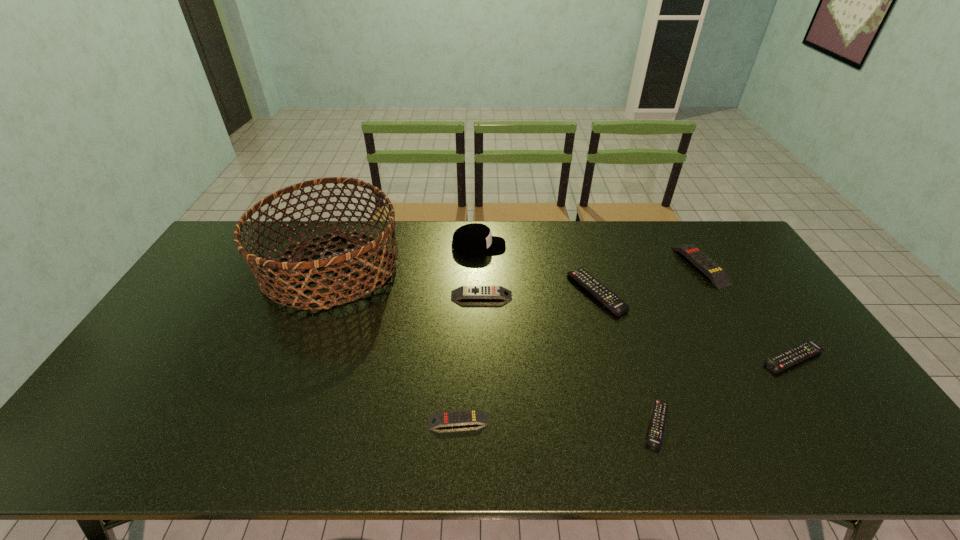
Locate an element on the screen. The image size is (960, 540). blank region between the tallest object and the farthest yellow remote control is located at coordinates (516, 266).

Identify which object is the second nearest to the rightmost black remote control. Please provide its 2D coordinates. Your answer should be formatted as a tuple, i.e. [(x, y)], where the tuple contains the x and y coordinates of a point satisfying the conditions above.

[(658, 418)]

The height and width of the screenshot is (540, 960). What are the coordinates of `object that stands as the fifth closest to the nearest black remote control` in the screenshot? It's located at (717, 275).

Identify the location of remote control that is the second nearest to the seventh shortest object. This screenshot has width=960, height=540. (610, 300).

What are the coordinates of `remote control that is the fifth closest one to the smallest black remote control` in the screenshot? It's located at (717, 275).

Locate an element on the screen. The height and width of the screenshot is (540, 960). the second closest yellow remote control to the basket is located at coordinates (465, 417).

Find the location of `yellow remote control that is the second closest one to the cap`. yellow remote control that is the second closest one to the cap is located at coordinates (717, 275).

In order to click on black remote control that stands as the closest to the biggest black remote control in this screenshot , I will do `click(658, 418)`.

This screenshot has height=540, width=960. I want to click on the closest black remote control to the biggest black remote control, so click(658, 418).

This screenshot has height=540, width=960. Find the location of `free location that satisfies the following two spatial constraints: 1. on the front-facing side of the black cap; 2. on the left side of the shortest remote control`. free location that satisfies the following two spatial constraints: 1. on the front-facing side of the black cap; 2. on the left side of the shortest remote control is located at coordinates (478, 424).